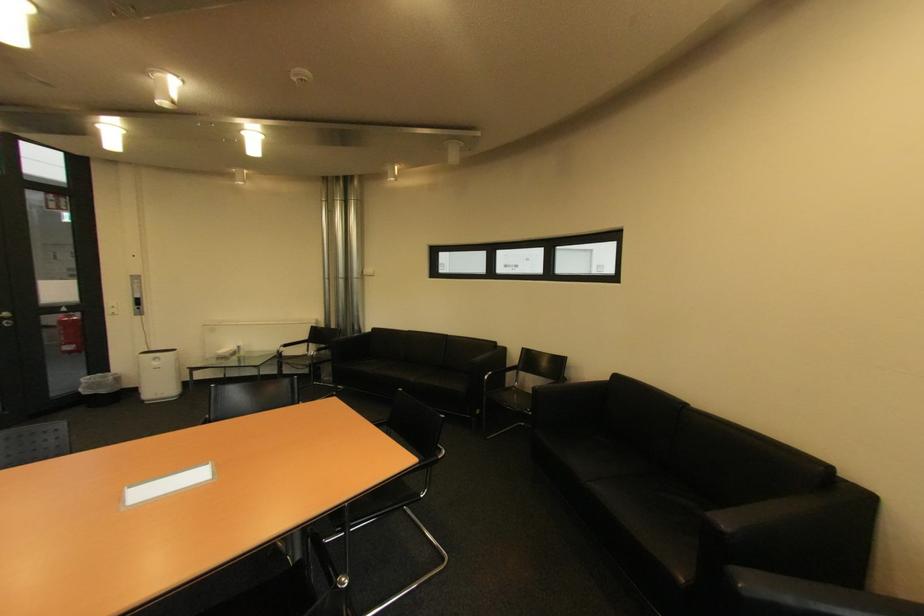
I want to click on white air purifier, so click(159, 375).